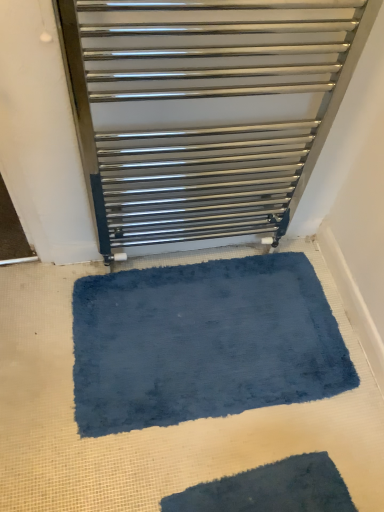
The width and height of the screenshot is (384, 512). Identify the location of free space to the left of dark blue shaggy bath mat at lower center, positioned as the second bath mat in back-to-front order. (133, 446).